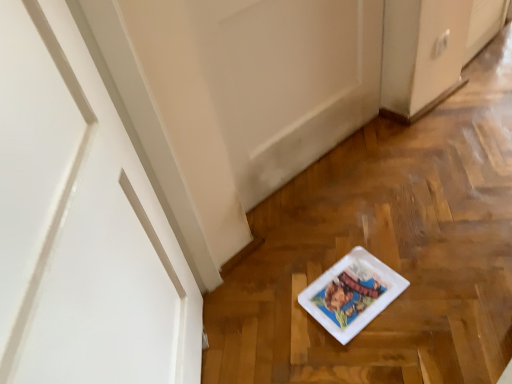
Find the location of `free region on the left part of white glossy platter at center`. free region on the left part of white glossy platter at center is located at coordinates (281, 295).